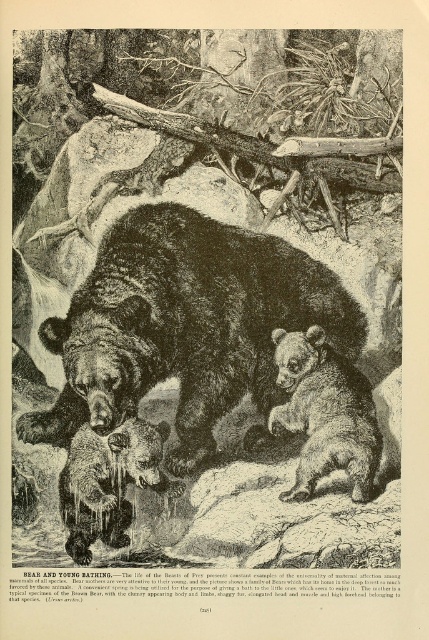
Question: Which object appears farthest from the camera in this image?

Choices:
 (A) dark brown fur bear at center
 (B) soft brown fur at center

Answer: (B)

Question: Is dark brown fur bear at center bigger than brown fur cub at lower left?

Choices:
 (A) no
 (B) yes

Answer: (B)

Question: Does dark brown fur bear at center come behind brown fur cub at lower left?

Choices:
 (A) yes
 (B) no

Answer: (B)

Question: Which object is farther from the camera taking this photo?

Choices:
 (A) brown fur cub at lower left
 (B) soft brown fur at center
 (C) dark brown fur bear at center

Answer: (A)

Question: Among these points, which one is farthest from the camera?

Choices:
 (A) (81, 468)
 (B) (165, 227)
 (C) (371, 472)

Answer: (B)

Question: Is dark brown fur bear at center in front of brown fur cub at lower left?

Choices:
 (A) no
 (B) yes

Answer: (B)